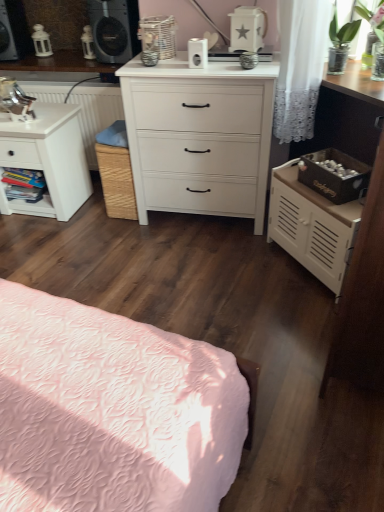
I want to click on free area in between white matte cabinet at right, the first nightstand in the right-to-left sequence, and white matte chest of drawers at center, so click(x=231, y=248).